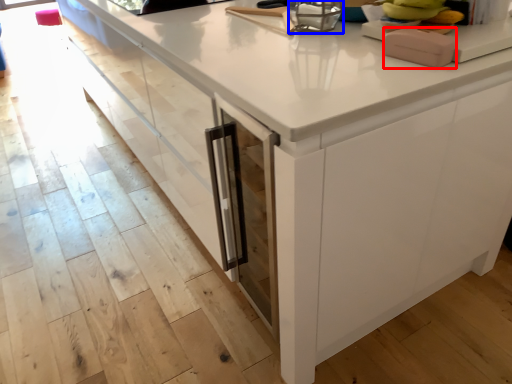
Question: Which point is closer to the camera, appliance (highlighted by a red box) or appliance (highlighted by a blue box)?

Choices:
 (A) appliance
 (B) appliance

Answer: (A)